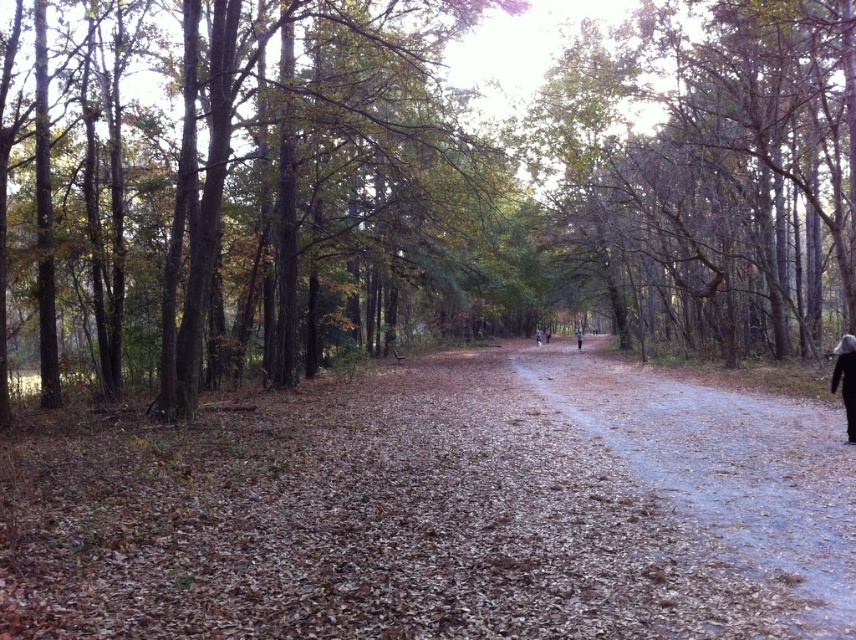
You are hiking along the brown leafy forest path at center and spot the dark gray woolen coat at right. Which object takes up more space in the image?

The brown leafy forest path at center takes up more space in the image than the dark gray woolen coat at right because it is bigger.

You are standing on the forest path and see the brown wood tree at left and the dark gray woolen coat at right. Which object is taller?

The brown wood tree at left is taller than the dark gray woolen coat at right.